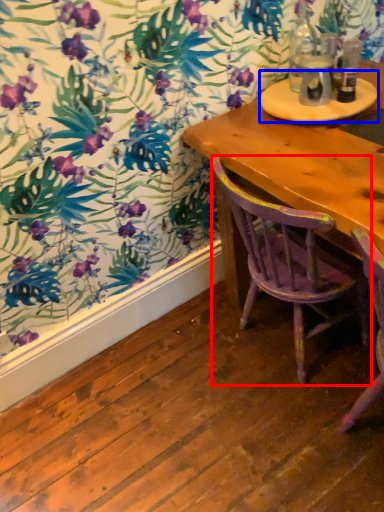
Question: Among these objects, which one is farthest to the camera, chair (highlighted by a red box) or round table (highlighted by a blue box)?

Choices:
 (A) chair
 (B) round table

Answer: (B)